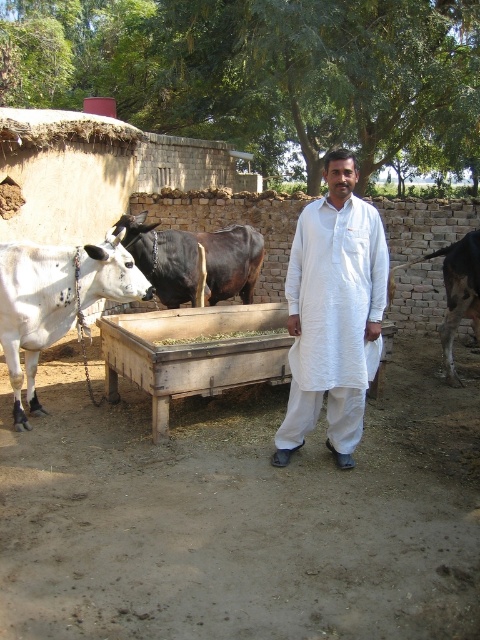
Question: Which point is closer to the camera?

Choices:
 (A) white cotton kurta at center
 (B) white glossy cow at left
 (C) black glossy bull at center
 (D) black glossy bull at right

Answer: (A)

Question: Is white glossy cow at left wider than black glossy bull at center?

Choices:
 (A) no
 (B) yes

Answer: (A)

Question: Based on their relative distances, which object is farther from the black glossy bull at right?

Choices:
 (A) white cotton kurta at center
 (B) white glossy cow at left

Answer: (B)

Question: In this image, where is white cotton kurta at center located relative to white glossy cow at left?

Choices:
 (A) left
 (B) right

Answer: (B)

Question: Which point appears farthest from the camera in this image?

Choices:
 (A) (109, 276)
 (B) (282, 464)
 (C) (143, 212)

Answer: (C)

Question: Does white glossy cow at left appear under black glossy bull at center?

Choices:
 (A) no
 (B) yes

Answer: (B)